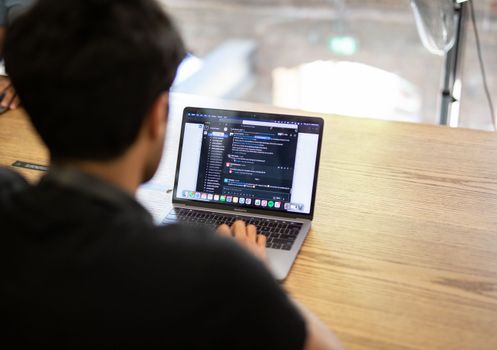
I want to click on laptop keyboard, so click(x=278, y=233).